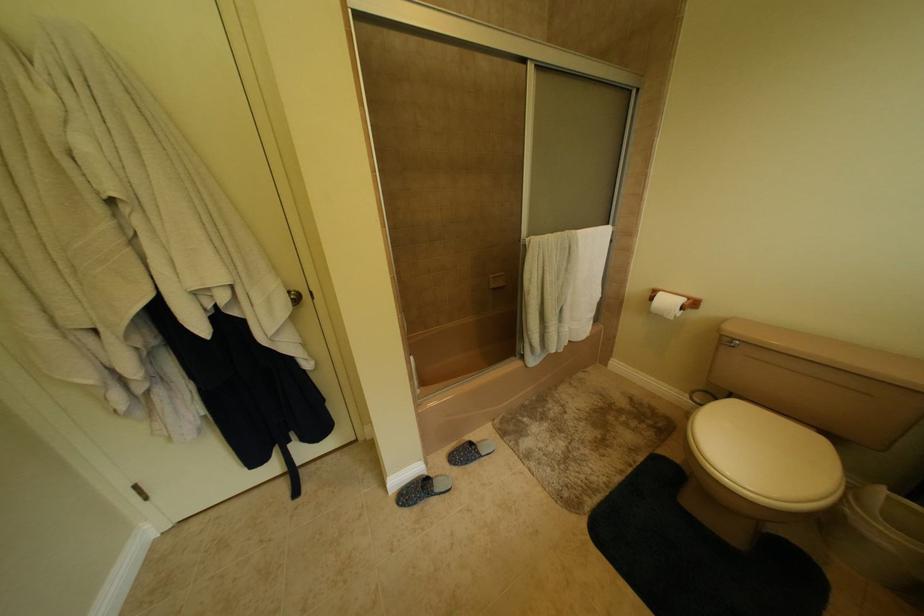
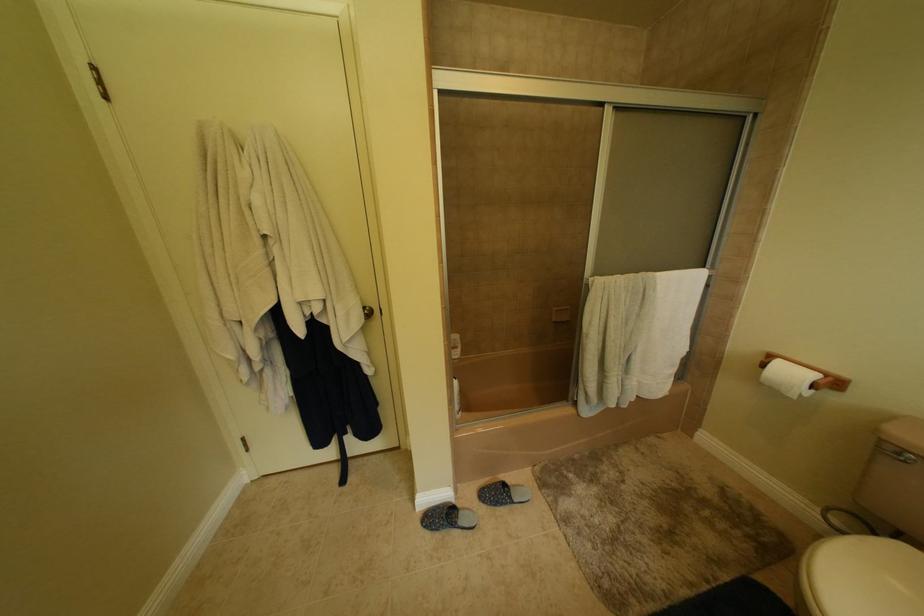
Question: The camera is either moving clockwise (left) or counter-clockwise (right) around the object. The first image is from the beginning of the video and the second image is from the end. Is the camera moving left or right when shooting the video?

Choices:
 (A) Left
 (B) Right

Answer: (B)